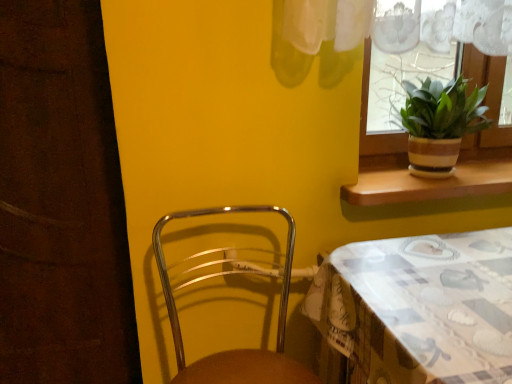
Question: From a real-world perspective, is patterned fabric table at lower right located beneath metallic brown chair at lower left?

Choices:
 (A) no
 (B) yes

Answer: (B)

Question: Does patterned fabric table at lower right come behind metallic brown chair at lower left?

Choices:
 (A) yes
 (B) no

Answer: (B)

Question: Is patterned fabric table at lower right to the left of metallic brown chair at lower left from the viewer's perspective?

Choices:
 (A) no
 (B) yes

Answer: (A)

Question: Does patterned fabric table at lower right have a lesser height compared to metallic brown chair at lower left?

Choices:
 (A) no
 (B) yes

Answer: (A)

Question: Can you confirm if patterned fabric table at lower right is smaller than metallic brown chair at lower left?

Choices:
 (A) no
 (B) yes

Answer: (A)

Question: Can you confirm if patterned fabric table at lower right is taller than metallic brown chair at lower left?

Choices:
 (A) no
 (B) yes

Answer: (B)

Question: Does patterned fabric table at lower right appear on the right side of brown wood at upper right?

Choices:
 (A) yes
 (B) no

Answer: (B)

Question: Considering the relative sizes of patterned fabric table at lower right and brown wood at upper right in the image provided, is patterned fabric table at lower right thinner than brown wood at upper right?

Choices:
 (A) yes
 (B) no

Answer: (B)

Question: Is patterned fabric table at lower right outside of brown wood at upper right?

Choices:
 (A) yes
 (B) no

Answer: (A)

Question: From a real-world perspective, is patterned fabric table at lower right physically above brown wood at upper right?

Choices:
 (A) no
 (B) yes

Answer: (A)

Question: From a real-world perspective, is patterned fabric table at lower right under brown wood at upper right?

Choices:
 (A) yes
 (B) no

Answer: (A)

Question: Is the depth of patterned fabric table at lower right greater than that of brown wood at upper right?

Choices:
 (A) no
 (B) yes

Answer: (A)

Question: Does brown wood at upper right contain patterned fabric table at lower right?

Choices:
 (A) no
 (B) yes

Answer: (A)